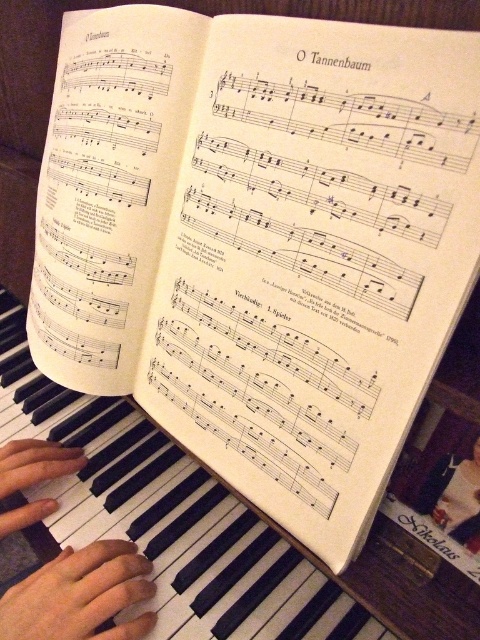
Question: Does skinny flesh-toned hand at piano keys appear on the right side of smooth skin hand at piano keys left?

Choices:
 (A) yes
 (B) no

Answer: (A)

Question: Which object appears closest to the camera in this image?

Choices:
 (A) black matte piano keys at center
 (B) skinny flesh-toned hand at piano keys
 (C) smooth skin hand at piano keys left
 (D) smooth skin hands at piano keys

Answer: (B)

Question: Is smooth skin hands at piano keys bigger than smooth skin hand at piano keys left?

Choices:
 (A) no
 (B) yes

Answer: (B)

Question: Is black matte piano keys at center thinner than smooth skin hands at piano keys?

Choices:
 (A) yes
 (B) no

Answer: (B)

Question: Which point appears closest to the camera in this image?

Choices:
 (A) (16, 525)
 (B) (36, 444)
 (C) (178, 525)

Answer: (A)

Question: Which object is positioned farthest from the smooth skin hand at piano keys left?

Choices:
 (A) smooth skin hands at piano keys
 (B) black matte piano keys at center

Answer: (B)